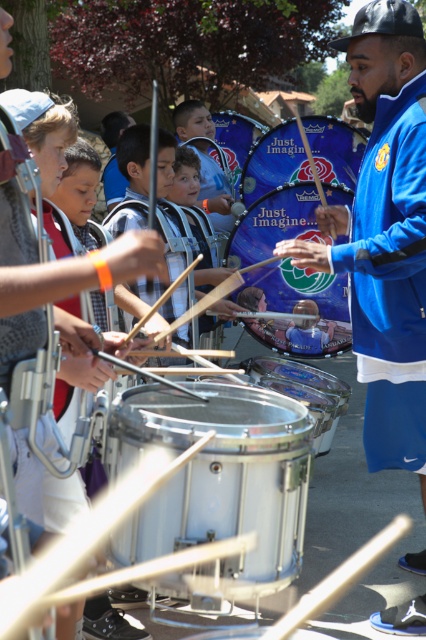
Measure the distance from blue fleece jacket at right to blue fabric drum at center.

A distance of 12.75 feet exists between blue fleece jacket at right and blue fabric drum at center.

From the picture: Can you confirm if blue fleece jacket at right is positioned below blue fabric drum at center?

Yes.

Is point (405, 173) behind point (368, 134)?

That is False.

What are the coordinates of `blue fleece jacket at right` in the screenshot? It's located at (391, 280).

Who is positioned more to the right, blue fleece jacket at right or shiny blue drum at center?

From the viewer's perspective, blue fleece jacket at right appears more on the right side.

Is blue fleece jacket at right positioned in front of shiny blue drum at center?

Yes, blue fleece jacket at right is in front of shiny blue drum at center.

What do you see at coordinates (391, 280) in the screenshot? This screenshot has width=426, height=640. I see `blue fleece jacket at right` at bounding box center [391, 280].

The width and height of the screenshot is (426, 640). Identify the location of blue fleece jacket at right. [x=391, y=280].

Between blue drum at center and shiny blue drum at center, which one is positioned higher?

shiny blue drum at center

Consider the image. Who is taller, blue drum at center or shiny blue drum at center?

blue drum at center

What do you see at coordinates (296, 307) in the screenshot? The height and width of the screenshot is (640, 426). I see `blue drum at center` at bounding box center [296, 307].

Find the location of a particular element. blue drum at center is located at coordinates (296, 307).